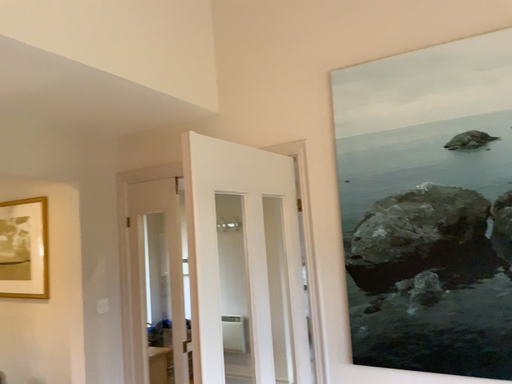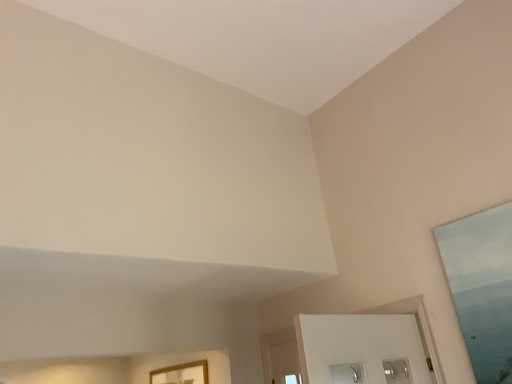
Question: How did the camera likely rotate when shooting the video?

Choices:
 (A) rotated right
 (B) rotated left

Answer: (B)